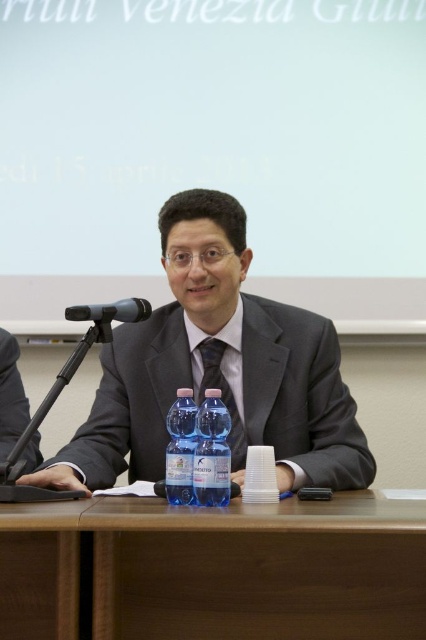
Does point (235, 458) come in front of point (127, 317)?

That is False.

Is black silk tie at center below black plastic microphone at left?

Yes, black silk tie at center is below black plastic microphone at left.

Is point (241, 419) positioned behind point (85, 316)?

Yes.

The image size is (426, 640). Find the location of `black silk tie at center`. black silk tie at center is located at coordinates (222, 397).

Is brown wooden table at center closer to the viewer compared to clear plastic bottle at center?

Yes, it is.

Is brown wooden table at center shorter than clear plastic bottle at center?

In fact, brown wooden table at center may be taller than clear plastic bottle at center.

The width and height of the screenshot is (426, 640). What do you see at coordinates (221, 568) in the screenshot?
I see `brown wooden table at center` at bounding box center [221, 568].

This screenshot has height=640, width=426. What are the coordinates of `brown wooden table at center` in the screenshot? It's located at (221, 568).

In the scene shown: Is clear plastic bottle at center to the right of black plastic microphone at left from the viewer's perspective?

Correct, you'll find clear plastic bottle at center to the right of black plastic microphone at left.

Based on the photo, which is more to the left, clear plastic bottle at center or black plastic microphone at left?

From the viewer's perspective, black plastic microphone at left appears more on the left side.

In the scene shown: Who is more forward, (209, 465) or (131, 314)?

Positioned in front is point (209, 465).

The width and height of the screenshot is (426, 640). What are the coordinates of `clear plastic bottle at center` in the screenshot? It's located at (212, 452).